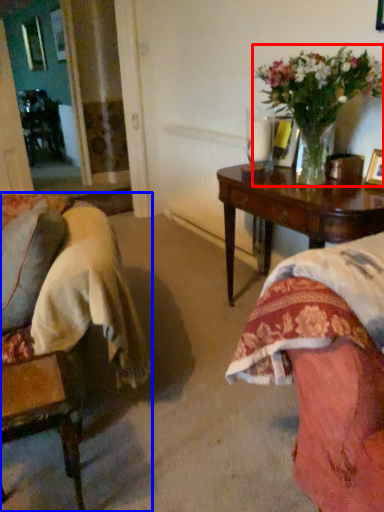
Question: Which object appears farthest to the camera in this image, houseplant (highlighted by a red box) or chair (highlighted by a blue box)?

Choices:
 (A) houseplant
 (B) chair

Answer: (A)